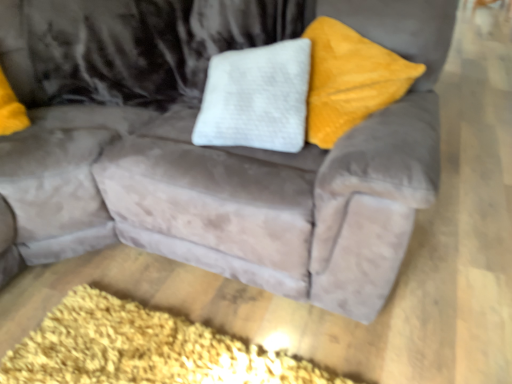
Identify the location of yellow fluffy rug at lower left. The height and width of the screenshot is (384, 512). (143, 349).

What do you see at coordinates (143, 349) in the screenshot?
I see `yellow fluffy rug at lower left` at bounding box center [143, 349].

At what (x,y) coordinates should I click in order to perform the action: click on yellow fluffy rug at lower left. Please return your answer as a coordinate pair (x, y). Image resolution: width=512 pixels, height=384 pixels. Looking at the image, I should click on (143, 349).